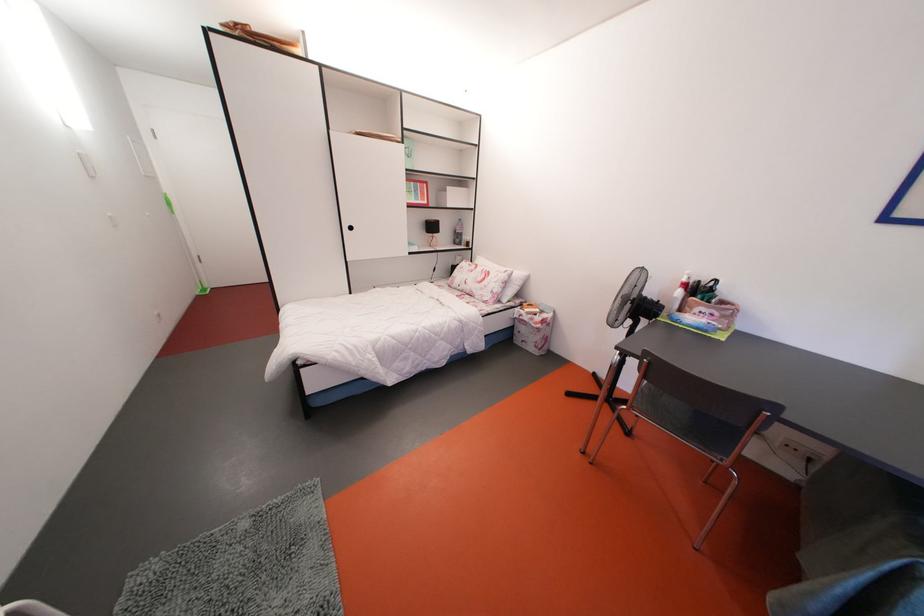
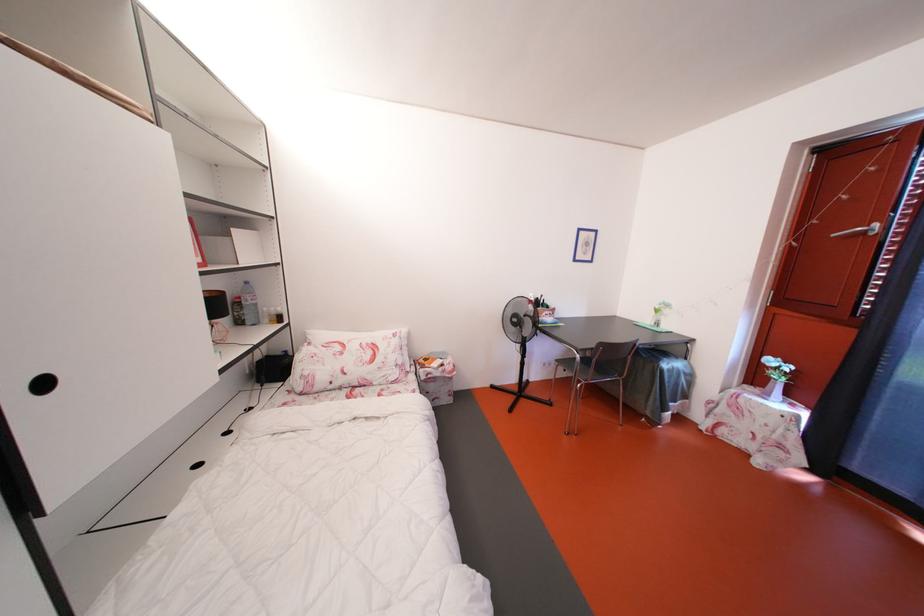
Find the pixel in the second image that matches point 533,325 in the first image.

(444, 379)